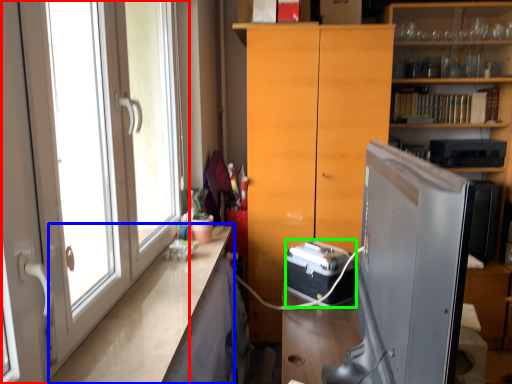
Question: Considering the real-world distances, which object is farthest from door (highlighted by a red box)? counter top (highlighted by a blue box) or appliance (highlighted by a green box)?

Choices:
 (A) counter top
 (B) appliance

Answer: (B)